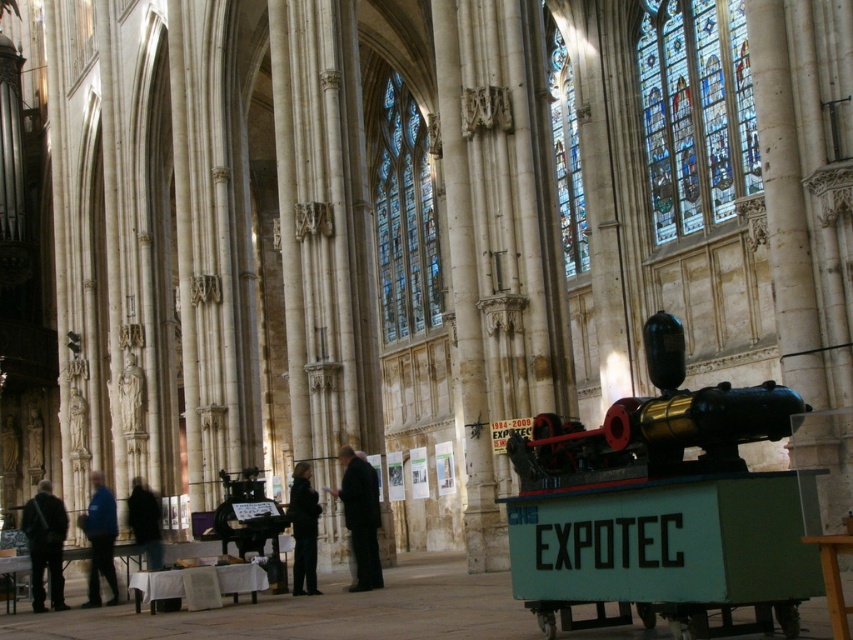
Does stained glass at upper right have a larger size compared to dark suit at center?

Indeed, stained glass at upper right has a larger size compared to dark suit at center.

In the scene shown: Does stained glass at upper right have a smaller size compared to dark suit at center?

No, stained glass at upper right is not smaller than dark suit at center.

Locate an element on the screen. stained glass at upper right is located at coordinates (695, 113).

Between stained glass at center and dark suit at center, which one has more height?

stained glass at center is taller.

Can you confirm if stained glass at center is wider than dark suit at center?

Indeed, stained glass at center has a greater width compared to dark suit at center.

Which is in front, point (392, 154) or point (350, 464)?

Point (350, 464) is in front.

Identify the location of stained glass at center. This screenshot has width=853, height=640. (404, 216).

Which of these two, blue stained glass at upper center or dark gray fabric coat at center, stands shorter?

With less height is dark gray fabric coat at center.

Is blue stained glass at upper center closer to the viewer compared to dark gray fabric coat at center?

No, it is behind dark gray fabric coat at center.

Is point (569, 269) more distant than point (306, 509)?

Yes.

This screenshot has height=640, width=853. In order to click on blue stained glass at upper center in this screenshot , I will do `click(566, 148)`.